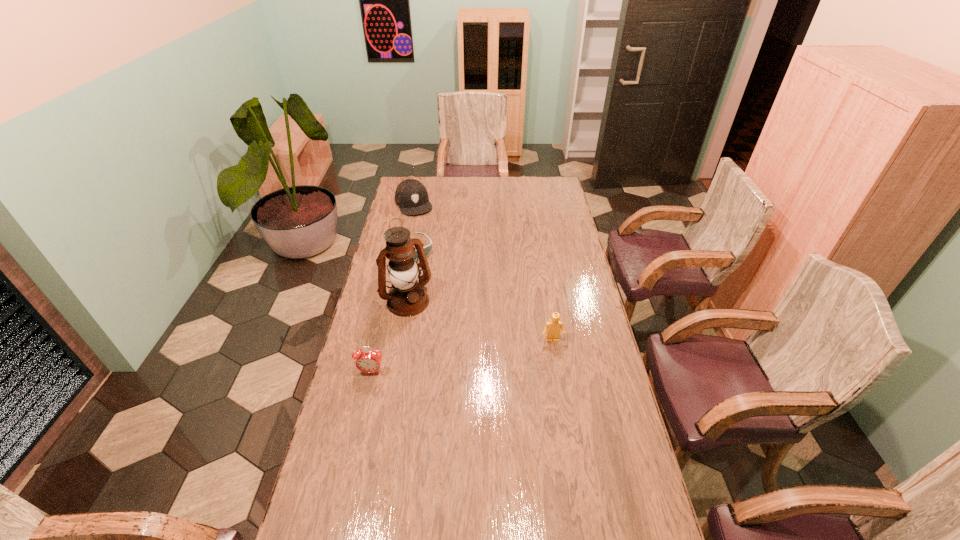
The height and width of the screenshot is (540, 960). Identify the location of free space located 0.340m on the side of the tallest object, there is a wick adjustment knob. (461, 376).

Locate an element on the screen. This screenshot has width=960, height=540. blank space located on the side of the tallest object, there is a wick adjustment knob is located at coordinates (435, 340).

The width and height of the screenshot is (960, 540). In order to click on free space located 0.210m on the side of the tallest object, there is a wick adjustment knob in this screenshot , I will do `click(443, 350)`.

At what (x,y) coordinates should I click in order to perform the action: click on free spot located on the front-facing side of the fourth nearest object. Please return your answer as a coordinate pair (x, y). Image resolution: width=960 pixels, height=540 pixels. Looking at the image, I should click on (438, 286).

The height and width of the screenshot is (540, 960). Find the location of `free space located on the front-facing side of the fourth nearest object`. free space located on the front-facing side of the fourth nearest object is located at coordinates (458, 315).

Where is `free space located 0.130m on the front-facing side of the fourth nearest object`? Image resolution: width=960 pixels, height=540 pixels. free space located 0.130m on the front-facing side of the fourth nearest object is located at coordinates (432, 278).

Find the location of `vacant space located on the front-facing side of the cap`. vacant space located on the front-facing side of the cap is located at coordinates [426, 233].

Identify the location of vacant region located 0.380m on the front-facing side of the cap. This screenshot has width=960, height=540. (439, 260).

This screenshot has height=540, width=960. What are the coordinates of `vacant space located on the front-facing side of the cap` in the screenshot? It's located at (426, 233).

Where is `object situated at the far edge`? The width and height of the screenshot is (960, 540). object situated at the far edge is located at coordinates (411, 196).